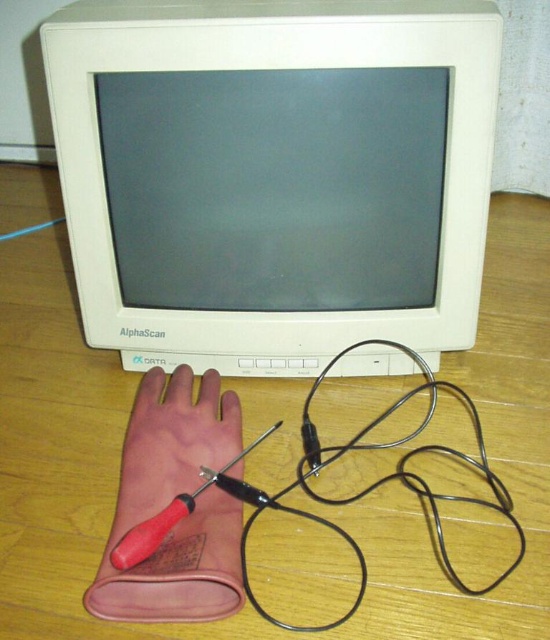
Question: Does white plastic computer monitor at upper center appear over black metallic wire at lower center?

Choices:
 (A) no
 (B) yes

Answer: (B)

Question: Observing the image, what is the correct spatial positioning of wooden table at center in reference to black metallic wire at lower center?

Choices:
 (A) below
 (B) above

Answer: (B)

Question: Among these points, which one is farthest from the camera?

Choices:
 (A) (363, 307)
 (B) (253, 515)

Answer: (A)

Question: Can you confirm if white plastic computer monitor at upper center is positioned to the left of brown leather glove at lower left?

Choices:
 (A) no
 (B) yes

Answer: (A)

Question: Among these points, which one is nearest to the camera?

Choices:
 (A) (184, 372)
 (B) (393, 348)
 (C) (249, 627)
 (D) (448, 1)

Answer: (C)

Question: Which of these objects is positioned closest to the brown leather glove at lower left?

Choices:
 (A) black metallic wire at lower center
 (B) white plastic computer monitor at upper center

Answer: (A)